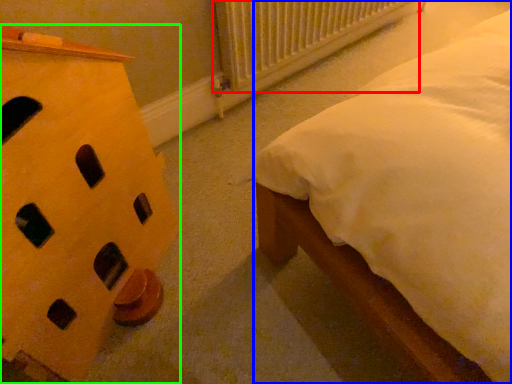
Question: Estimate the real-world distances between objects in this image. Which object is farther from radiator (highlighted by a red box), nightstand (highlighted by a blue box) or furniture (highlighted by a green box)?

Choices:
 (A) nightstand
 (B) furniture

Answer: (B)